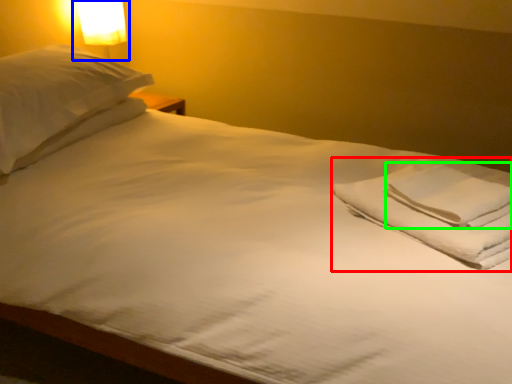
Question: Estimate the real-world distances between objects in this image. Which object is closer to material (highlighted by a red box), bedside lamp (highlighted by a blue box) or hand towel (highlighted by a green box)?

Choices:
 (A) bedside lamp
 (B) hand towel

Answer: (B)